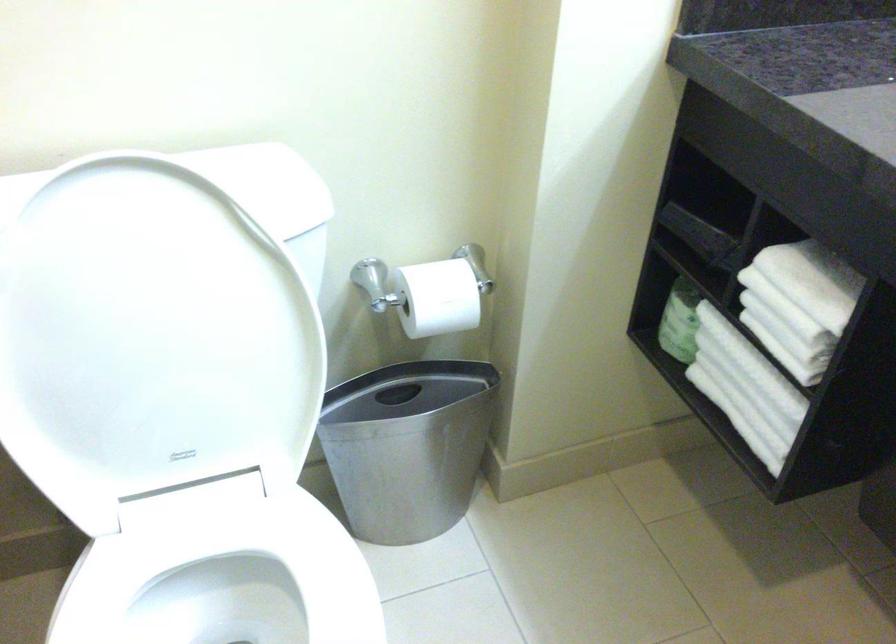
The location [679,321] corresponds to which object?

This point indicates the green plastic bottle.